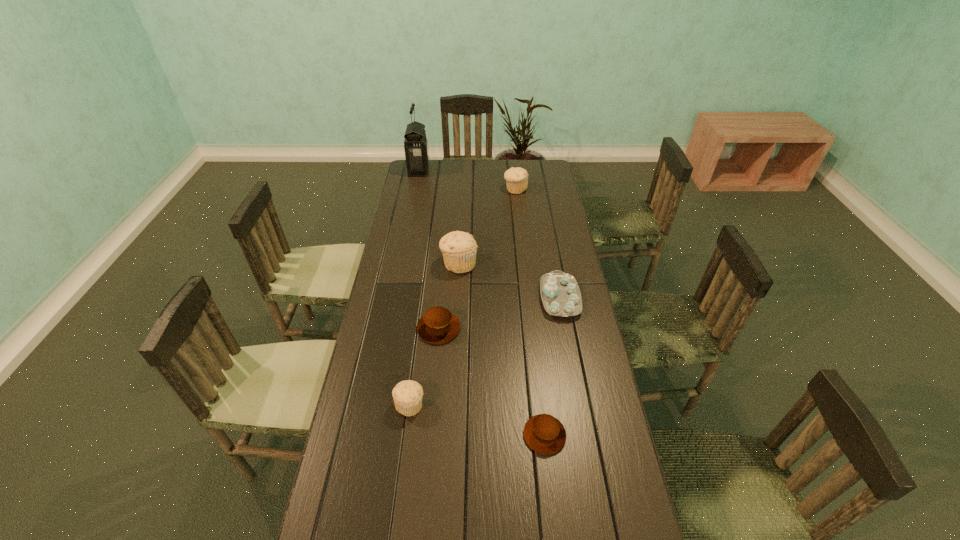
Locate which muffin is the closest to the shortest object. Please provide its 2D coordinates. Your answer should be formatted as a tuple, i.e. [(x, y)], where the tuple contains the x and y coordinates of a point satisfying the conditions above.

[(407, 395)]

Locate an element on the screen. The height and width of the screenshot is (540, 960). muffin that is the fourth closest to the chinaware is located at coordinates (407, 395).

Select which beige muffin appears as the closest to the smaller brown muffin. Please provide its 2D coordinates. Your answer should be formatted as a tuple, i.e. [(x, y)], where the tuple contains the x and y coordinates of a point satisfying the conditions above.

[(407, 395)]

Locate an element on the screen. The image size is (960, 540). beige muffin identified as the closest to the farthest beige muffin is located at coordinates (459, 248).

Locate which brown muffin ranks in proximity to the farthest object. Please provide its 2D coordinates. Your answer should be formatted as a tuple, i.e. [(x, y)], where the tuple contains the x and y coordinates of a point satisfying the conditions above.

[(438, 325)]

Locate an element on the screen. brown muffin that is the second closest to the leftmost beige muffin is located at coordinates (543, 433).

In order to click on vacant space that satisfies the following two spatial constraints: 1. on the front-facing side of the farthest object; 2. on the left side of the third nearest muffin in this screenshot , I will do 387,328.

At what (x,y) coordinates should I click in order to perform the action: click on free location that satisfies the following two spatial constraints: 1. on the front-facing side of the leftmost object; 2. on the left side of the nearest beige muffin. Please return your answer as a coordinate pair (x, y). Image resolution: width=960 pixels, height=540 pixels. Looking at the image, I should click on (372, 404).

You are a GUI agent. You are given a task and a screenshot of the screen. Output one action in this format:
    pyautogui.click(x=<x>, y=<y>)
    Task: Click on the free space that satisfies the following two spatial constraints: 1. on the front-facing side of the smaller brown muffin; 2. on the left side of the lantern
    
    Given the screenshot: What is the action you would take?
    pyautogui.click(x=366, y=435)